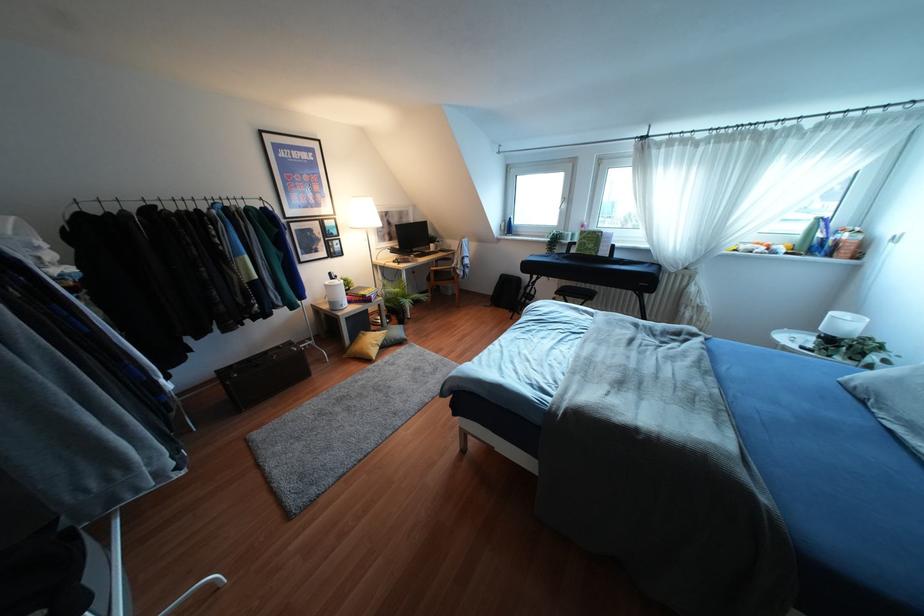
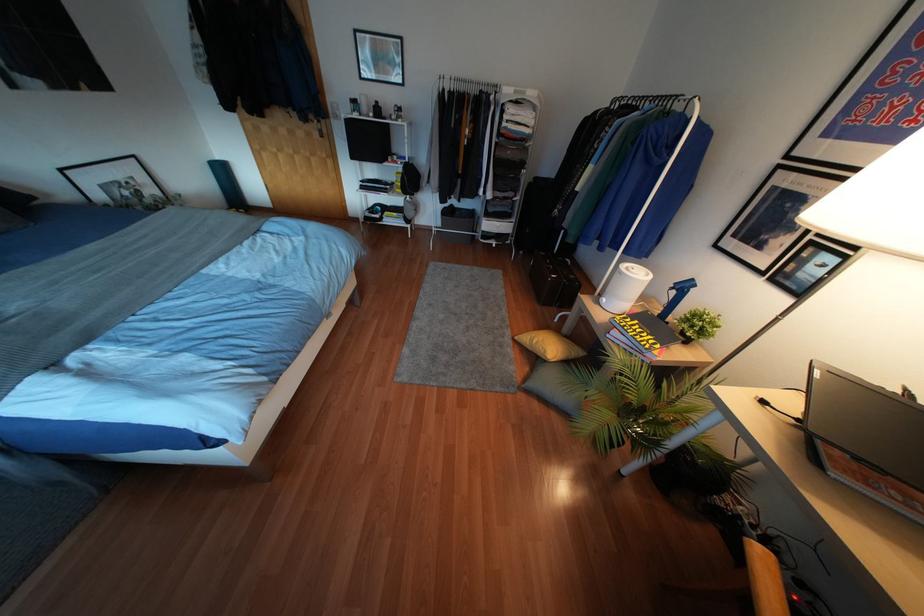
Find the pixel in the second image that matches (330,273) in the first image.

(690, 280)